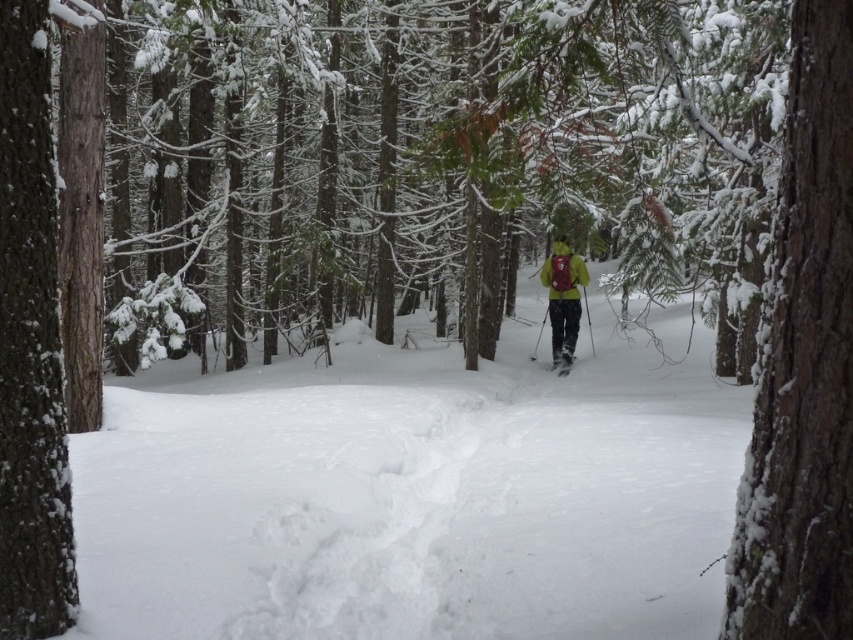
Is snow-covered bark at right further to camera compared to matte yellow ski at center?

That is False.

Is snow-covered bark at right in front of matte yellow ski at center?

Yes.

Where is `snow-covered bark at right`? snow-covered bark at right is located at coordinates (804, 364).

Identify the location of snow-covered bark at right. (804, 364).

Can you confirm if snow-covered bark at right is bigger than snow-covered tree trunk at left?

Correct, snow-covered bark at right is larger in size than snow-covered tree trunk at left.

Can you confirm if snow-covered bark at right is positioned below snow-covered tree trunk at left?

Yes, snow-covered bark at right is below snow-covered tree trunk at left.

Describe the element at coordinates (804, 364) in the screenshot. I see `snow-covered bark at right` at that location.

You are a GUI agent. You are given a task and a screenshot of the screen. Output one action in this format:
    pyautogui.click(x=<x>, y=<y>)
    Task: Click on the snow-covered bark at right
    This screenshot has width=853, height=640.
    Given the screenshot: What is the action you would take?
    pos(804,364)

In the scene shown: Does snow-covered bark at right have a lesser width compared to green matte jacket at center?

Yes, snow-covered bark at right is thinner than green matte jacket at center.

Does point (801, 145) lie in front of point (563, 291)?

That is True.

Identify the location of snow-covered bark at right. (804, 364).

You are a GUI agent. You are given a task and a screenshot of the screen. Output one action in this format:
    pyautogui.click(x=<x>, y=<y>)
    Task: Click on the snow-covered bark at right
    The height and width of the screenshot is (640, 853).
    Given the screenshot: What is the action you would take?
    pyautogui.click(x=804, y=364)